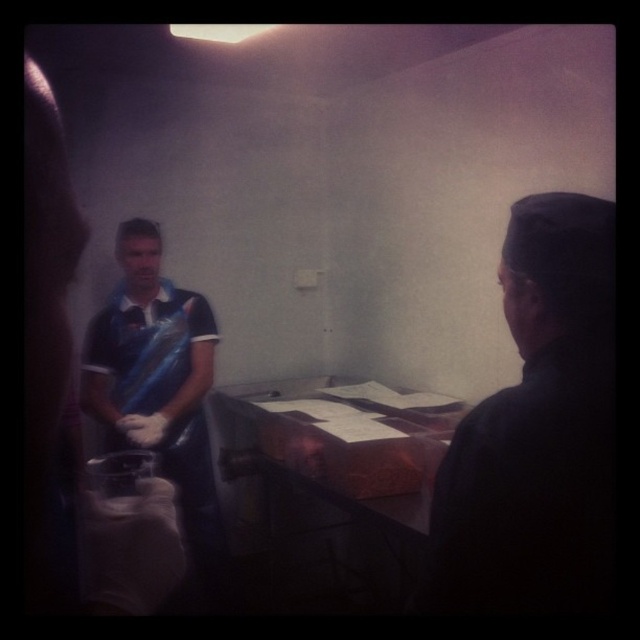
Is point (593, 449) positioned before point (173, 445)?

Yes, it is in front of point (173, 445).

Is dark matte cap at right below blue plastic bag at left?

Actually, dark matte cap at right is above blue plastic bag at left.

Which is in front, point (560, 481) or point (180, 376)?

Positioned in front is point (560, 481).

Where is `dark matte cap at right`? This screenshot has height=640, width=640. dark matte cap at right is located at coordinates (538, 432).